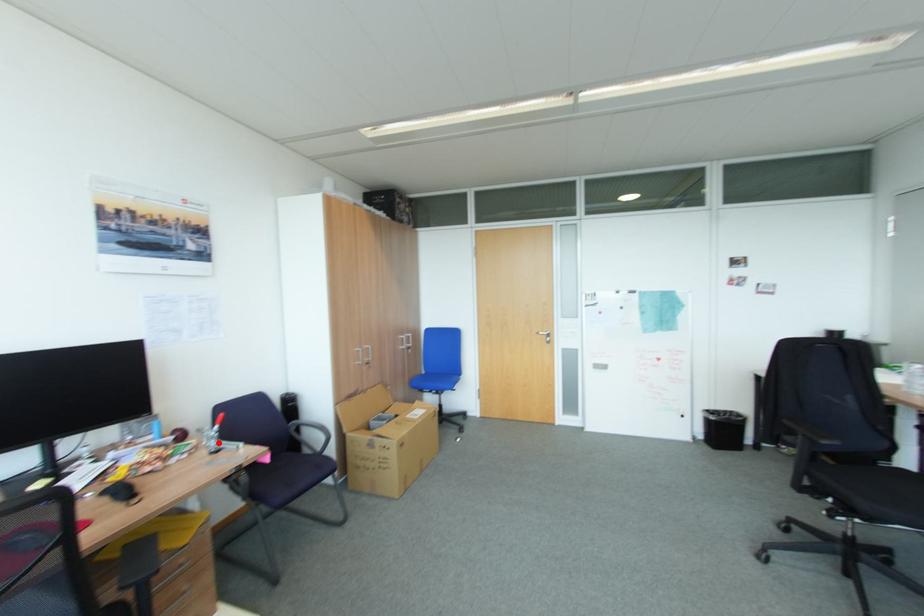
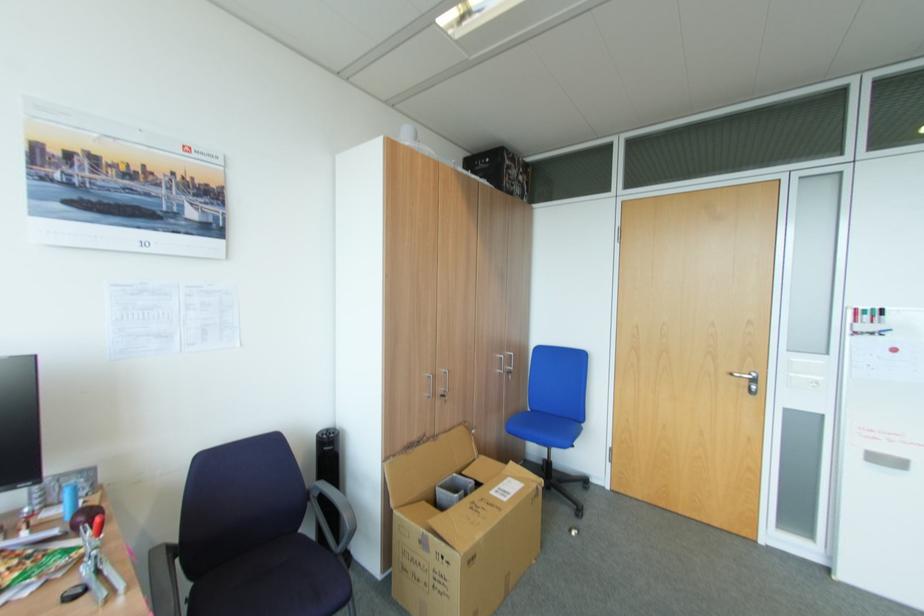
Where in the second image is the point corresponding to the highlighted location from the first image?

(91, 569)